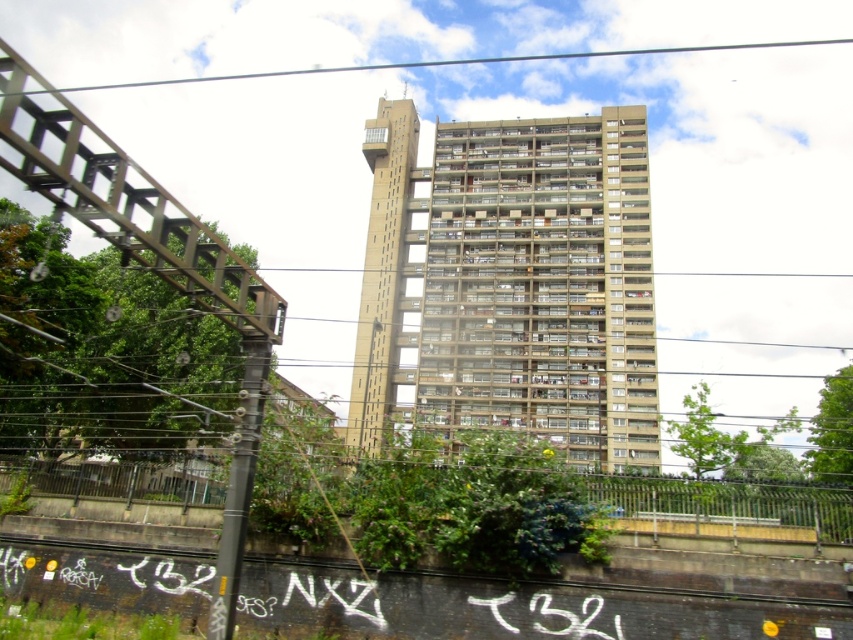
Question: Does beige concrete tower block at center lie behind black wire at upper center?

Choices:
 (A) no
 (B) yes

Answer: (B)

Question: Which object is closer to the camera taking this photo?

Choices:
 (A) black wire at upper center
 (B) beige concrete tower block at center

Answer: (A)

Question: Can you confirm if beige concrete tower block at center is smaller than black wire at upper center?

Choices:
 (A) yes
 (B) no

Answer: (A)

Question: Is beige concrete tower block at center smaller than black wire at upper center?

Choices:
 (A) no
 (B) yes

Answer: (B)